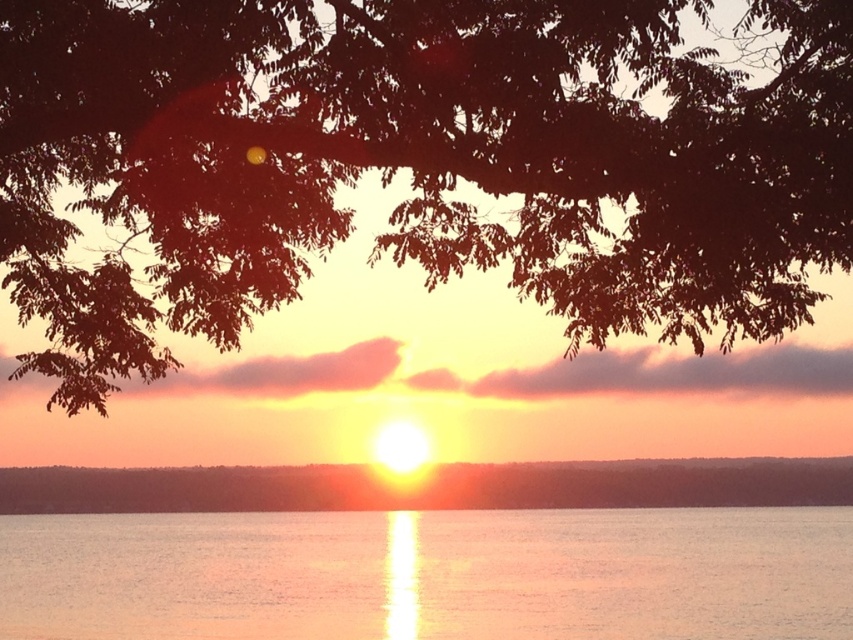
You are an artist trying to paint the sunset scene. You notice the dark brown leafy branches at upper center and the smooth orange sky at center. Which object is positioned to the left of the other?

The dark brown leafy branches at upper center is to the left of smooth orange sky at center.

You are a photographer wanting to capture the sunset reflection on the water without the branches blocking the view. Based on the scene, can you determine if the dark brown leafy branches at upper center will block the reflective silver water at center from your viewpoint?

The dark brown leafy branches at upper center are much taller than the reflective silver water at center, so they will block the view of the reflective silver water at center from your viewpoint.

You are standing at the edge of the water in the sunset scene. There is a reflective silver water at center marked by point [430,576]. If you want to walk towards the point where the reflective silver water is located, which direction should you head?

You should head towards the center of the water where the point [430,576] is located, as that is where the reflective silver water at center is situated.